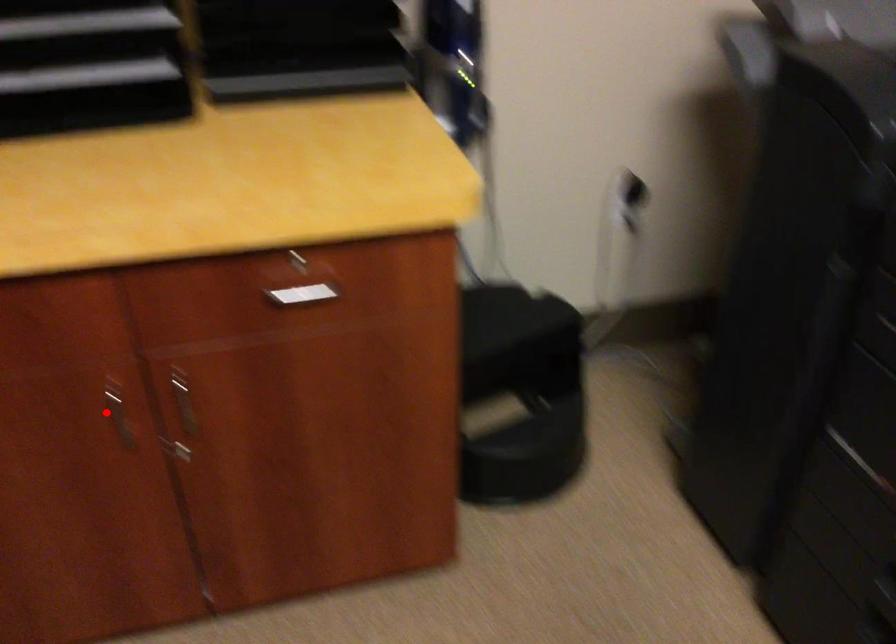
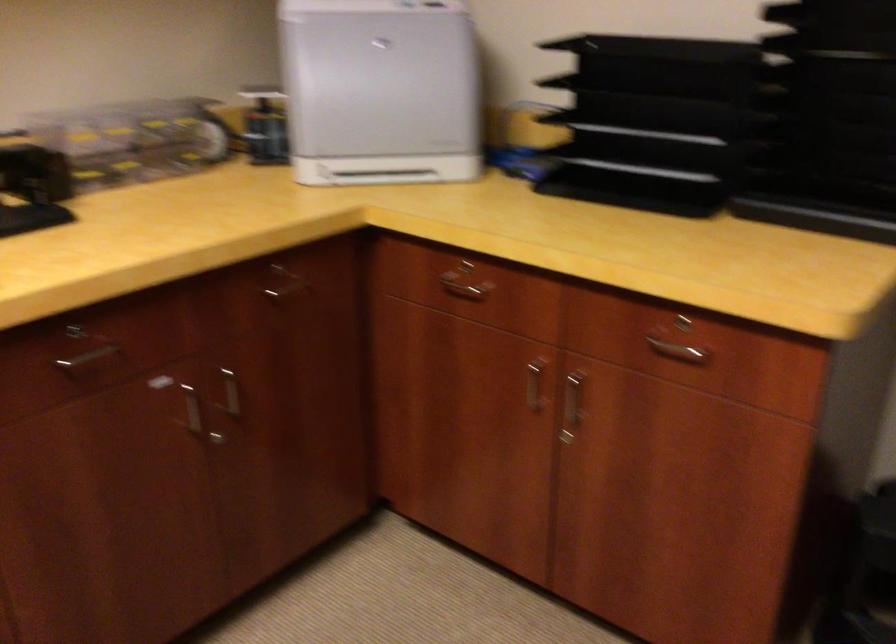
Locate, in the second image, the point that corresponds to the highlighted location in the first image.

(533, 386)